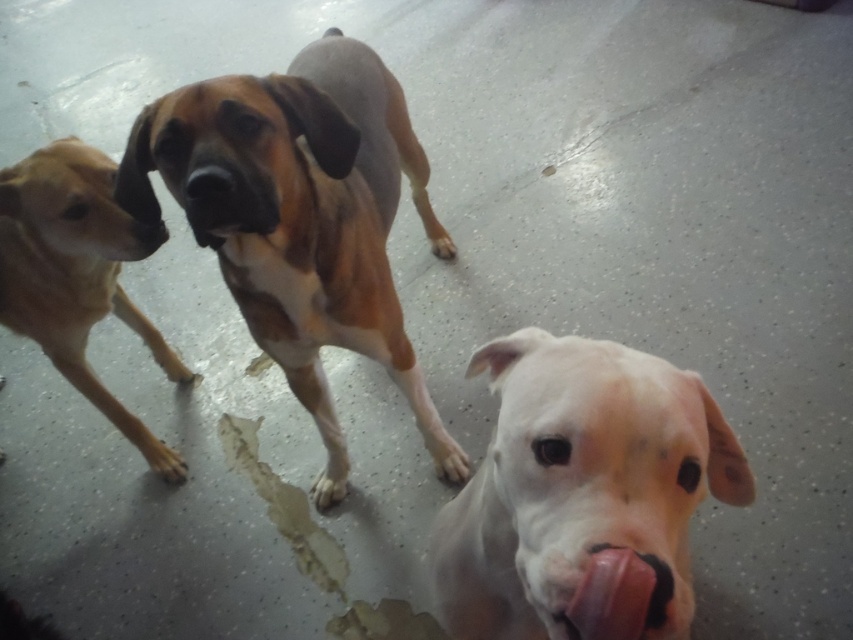
Question: Based on their relative distances, which object is farther from the black smooth nose at center?

Choices:
 (A) white matte dog at center
 (B) brown/white fur dog at center
 (C) brown matte nose at center

Answer: (A)

Question: Is pink rubber toy at lower center to the left of brown matte nose at center from the viewer's perspective?

Choices:
 (A) yes
 (B) no

Answer: (B)

Question: Is white matte dog at center to the right of brown smooth dog at left from the viewer's perspective?

Choices:
 (A) no
 (B) yes

Answer: (B)

Question: Which object is the farthest from the pink rubber toy at lower center?

Choices:
 (A) white matte dog at center
 (B) black smooth nose at center
 (C) brown/white fur dog at center
 (D) brown matte nose at center

Answer: (D)

Question: Can you confirm if brown smooth dog at left is thinner than brown matte nose at center?

Choices:
 (A) no
 (B) yes

Answer: (A)

Question: Which object is closer to the camera taking this photo?

Choices:
 (A) pink rubber toy at lower center
 (B) brown smooth dog at left

Answer: (A)